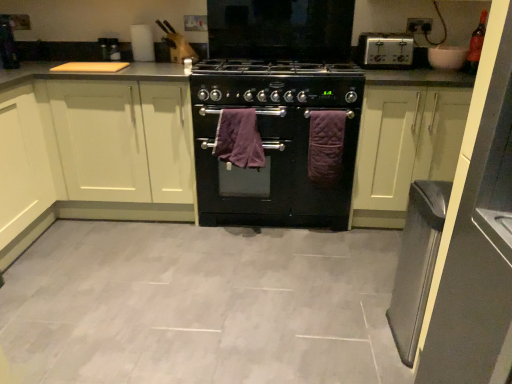
Identify the location of vacant area on top of white matte cabinet at left, marked as the 1th cabinetry in a left-to-right arrangement (from a real-world perspective). (95, 61).